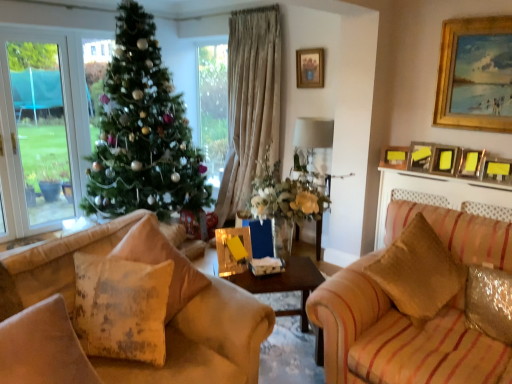
Question: Is green matte christmas tree at center located outside wooden table at center?

Choices:
 (A) no
 (B) yes

Answer: (B)

Question: Is green matte christmas tree at center directly adjacent to wooden table at center?

Choices:
 (A) yes
 (B) no

Answer: (B)

Question: Considering the relative sizes of green matte christmas tree at center and wooden table at center in the image provided, is green matte christmas tree at center wider than wooden table at center?

Choices:
 (A) yes
 (B) no

Answer: (A)

Question: Is green matte christmas tree at center looking in the opposite direction of wooden table at center?

Choices:
 (A) yes
 (B) no

Answer: (B)

Question: Considering the relative positions of green matte christmas tree at center and wooden table at center in the image provided, is green matte christmas tree at center behind wooden table at center?

Choices:
 (A) no
 (B) yes

Answer: (B)

Question: Based on their positions, is distressed yellow pillow at lower left, arranged as the second pillow when viewed from the left, located to the left or right of matte gold picture frame at upper right, marked as the 2th picture frame in a left-to-right arrangement?

Choices:
 (A) right
 (B) left

Answer: (B)

Question: From the image's perspective, relative to matte gold picture frame at upper right, placed as the sixth picture frame when sorted from right to left, is distressed yellow pillow at lower left, arranged as the second pillow when viewed from the left, above or below?

Choices:
 (A) below
 (B) above

Answer: (A)

Question: Is distressed yellow pillow at lower left, arranged as the second pillow when viewed from the left, taller or shorter than matte gold picture frame at upper right, placed as the sixth picture frame when sorted from right to left?

Choices:
 (A) tall
 (B) short

Answer: (A)

Question: From a real-world perspective, is distressed yellow pillow at lower left, which is the third pillow from right to left, positioned above or below matte gold picture frame at upper right, marked as the 2th picture frame in a left-to-right arrangement?

Choices:
 (A) above
 (B) below

Answer: (B)

Question: Relative to distressed yellow pillow at lower left, which is the third pillow from right to left, is yellow matte picture frame at upper right, which is the fourth picture frame in right-to-left order, in front or behind?

Choices:
 (A) behind
 (B) front

Answer: (A)

Question: Is yellow matte picture frame at upper right, which is the fourth picture frame in right-to-left order, spatially inside distressed yellow pillow at lower left, which is the third pillow from right to left, or outside of it?

Choices:
 (A) inside
 (B) outside

Answer: (B)

Question: Is yellow matte picture frame at upper right, which is the fourth picture frame in right-to-left order, bigger or smaller than distressed yellow pillow at lower left, arranged as the second pillow when viewed from the left?

Choices:
 (A) big
 (B) small

Answer: (B)

Question: From a real-world perspective, is yellow matte picture frame at upper right, which is the fourth picture frame in right-to-left order, physically located above or below distressed yellow pillow at lower left, arranged as the second pillow when viewed from the left?

Choices:
 (A) below
 (B) above

Answer: (B)

Question: Based on their positions, is metallic silver picture frame at upper right, acting as the fifth picture frame starting from the right, located to the left or right of yellow matte picture frame at upper right, which is counted as the fourth picture frame, starting from the left?

Choices:
 (A) left
 (B) right

Answer: (A)

Question: In terms of height, does metallic silver picture frame at upper right, marked as the 3th picture frame in a left-to-right arrangement, look taller or shorter compared to yellow matte picture frame at upper right, which is the fourth picture frame in right-to-left order?

Choices:
 (A) tall
 (B) short

Answer: (B)